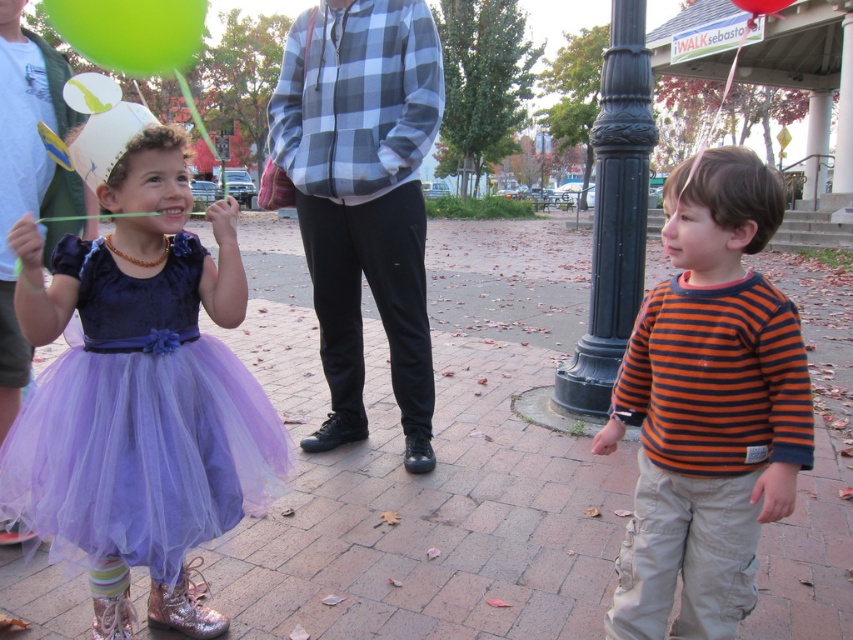
In the autumn park scene, there is a lavender tulle dress at left and a green rubber balloon at upper left. Which object is narrower in width?

The lavender tulle dress at left is narrower in width than the green rubber balloon at upper left.